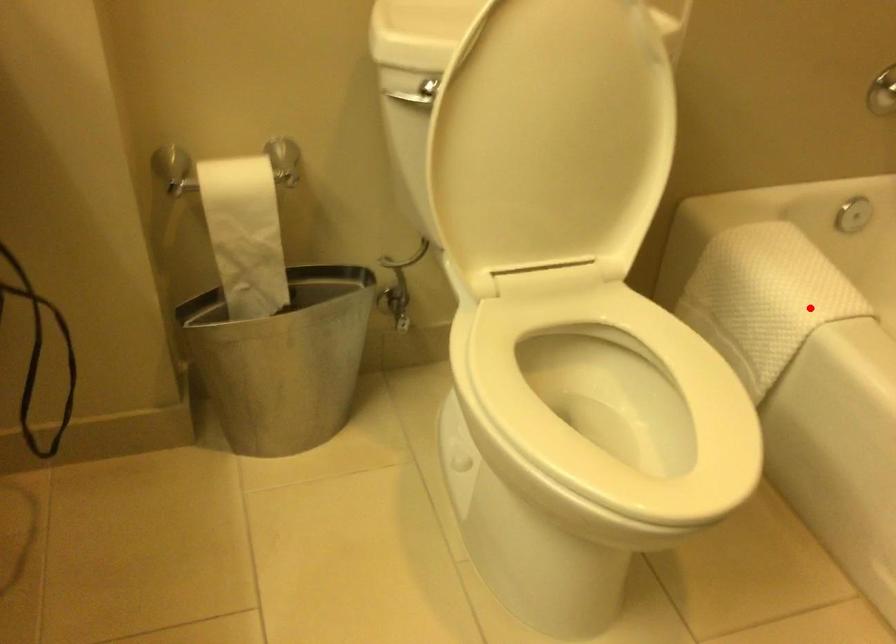
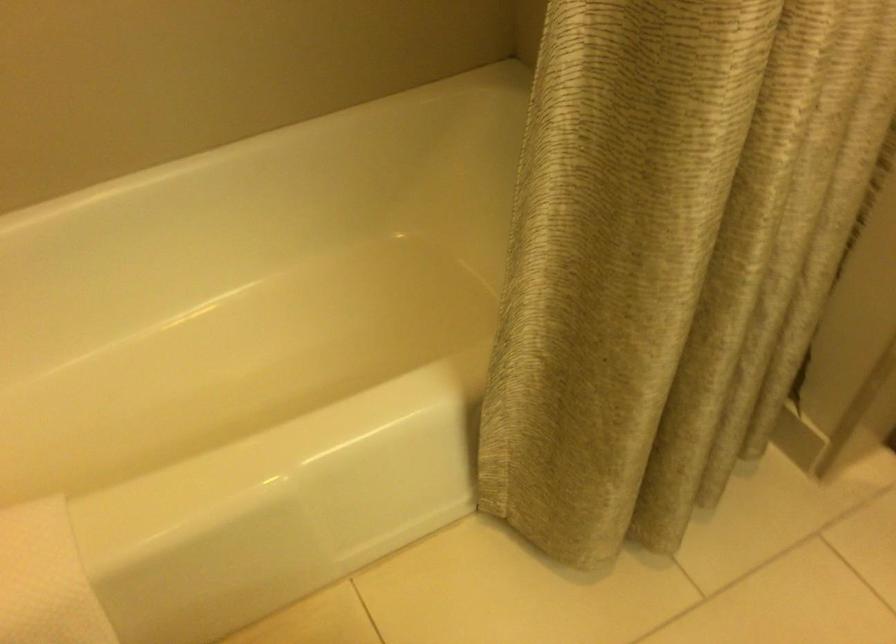
In the second image, find the point that corresponds to the highlighted location in the first image.

(46, 579)